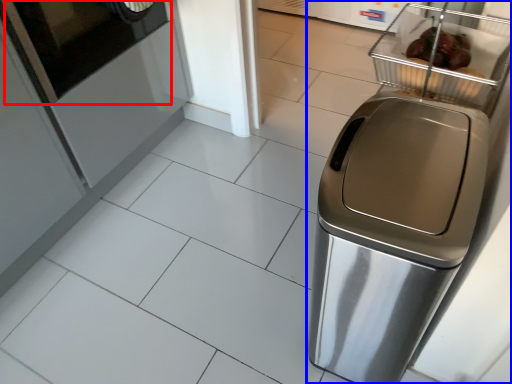
Question: Which object appears farthest to the camera in this image, screen door (highlighted by a red box) or home appliance (highlighted by a blue box)?

Choices:
 (A) screen door
 (B) home appliance

Answer: (A)